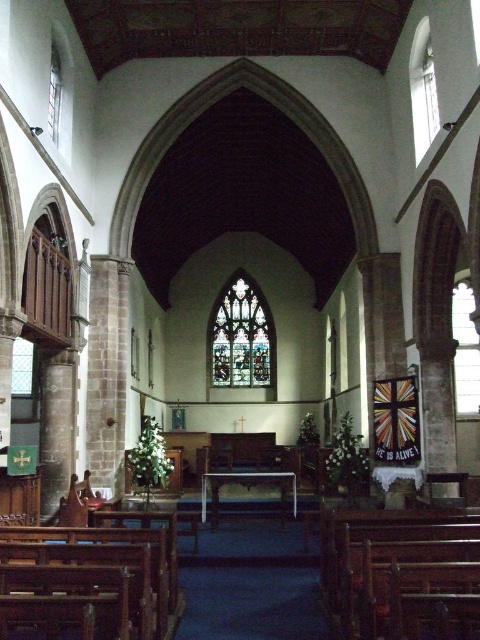
Question: Can you confirm if stained glass window at center is positioned above clear stained glass window at upper right?

Choices:
 (A) yes
 (B) no

Answer: (A)

Question: Which object appears farthest from the camera in this image?

Choices:
 (A) clear stained glass window at upper right
 (B) stained glass window at center

Answer: (B)

Question: Does clear stained glass window at upper right have a smaller size compared to clear glass window at upper center?

Choices:
 (A) yes
 (B) no

Answer: (B)

Question: Among these points, which one is farthest from the camera?

Choices:
 (A) (248, 305)
 (B) (455, 358)

Answer: (A)

Question: Which object appears farthest from the camera in this image?

Choices:
 (A) clear glass window at left
 (B) clear glass window at upper center
 (C) stained glass window at center
 (D) clear stained glass window at upper right

Answer: (C)

Question: Is clear stained glass window at upper right to the left of clear glass window at left from the viewer's perspective?

Choices:
 (A) no
 (B) yes

Answer: (A)